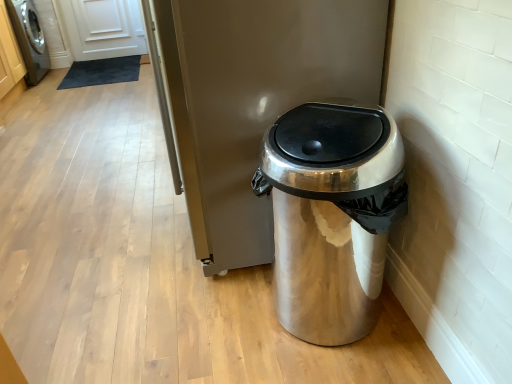
I want to click on satin silver trash can at center, so click(252, 100).

From the image's perspective, between brushed metal washing machine at left and shiny metallic trash can at lower right, which one is located above?

brushed metal washing machine at left is shown above in the image.

Is brushed metal washing machine at left situated inside shiny metallic trash can at lower right or outside?

brushed metal washing machine at left is located beyond the bounds of shiny metallic trash can at lower right.

Is brushed metal washing machine at left next to shiny metallic trash can at lower right?

No, brushed metal washing machine at left is not making contact with shiny metallic trash can at lower right.

Considering the sizes of brushed metal washing machine at left and shiny metallic trash can at lower right in the image, is brushed metal washing machine at left bigger or smaller than shiny metallic trash can at lower right?

Considering their sizes, brushed metal washing machine at left takes up more space than shiny metallic trash can at lower right.

From the picture: From a real-world perspective, is satin silver trash can at center on brushed metal washing machine at left?

Correct, in the physical world, satin silver trash can at center is higher than brushed metal washing machine at left.

From the image's perspective, which one is positioned lower, satin silver trash can at center or brushed metal washing machine at left?

From the image's view, satin silver trash can at center is below.

Is satin silver trash can at center turned away from brushed metal washing machine at left?

satin silver trash can at center is not turned away from brushed metal washing machine at left.

You are a GUI agent. You are given a task and a screenshot of the screen. Output one action in this format:
    pyautogui.click(x=<x>, y=<y>)
    Task: Click on the washing machine that is behind the satin silver trash can at center
    The width and height of the screenshot is (512, 384).
    Given the screenshot: What is the action you would take?
    pyautogui.click(x=29, y=39)

In terms of size, does brushed metal washing machine at left appear bigger or smaller than satin silver trash can at center?

Considering their sizes, brushed metal washing machine at left takes up less space than satin silver trash can at center.

Is brushed metal washing machine at left closer to the viewer compared to satin silver trash can at center?

That is False.

From a real-world perspective, between brushed metal washing machine at left and satin silver trash can at center, who is vertically higher?

In real-world perspective, satin silver trash can at center is above.

Considering the sizes of objects shiny metallic trash can at lower right and satin silver trash can at center in the image provided, who is smaller, shiny metallic trash can at lower right or satin silver trash can at center?

shiny metallic trash can at lower right.

In the image, there is a shiny metallic trash can at lower right. What are the coordinates of `appliance above it (from the image's perspective)` in the screenshot? It's located at (252, 100).

Could you tell me if shiny metallic trash can at lower right is turned towards satin silver trash can at center?

No, shiny metallic trash can at lower right is not facing towards satin silver trash can at center.

Is point (270, 57) behind point (274, 223)?

No, it is in front of (274, 223).

Find the location of a particular element. Image resolution: width=512 pixels, height=384 pixels. appliance above the shiny metallic trash can at lower right (from the image's perspective) is located at coordinates (252, 100).

In the scene shown: Is shiny metallic trash can at lower right completely or partially inside satin silver trash can at center?

No, satin silver trash can at center does not contain shiny metallic trash can at lower right.

Looking at this image, is satin silver trash can at center far from shiny metallic trash can at lower right?

satin silver trash can at center is near shiny metallic trash can at lower right, not far away.

In terms of height, does shiny metallic trash can at lower right look taller or shorter compared to brushed metal washing machine at left?

Clearly, shiny metallic trash can at lower right is shorter compared to brushed metal washing machine at left.

Is point (321, 339) positioned behind point (33, 72)?

No, (321, 339) is closer to viewer.

Is shiny metallic trash can at lower right completely or partially outside of brushed metal washing machine at left?

Yes, shiny metallic trash can at lower right is outside of brushed metal washing machine at left.

From the picture: Considering the positions of objects shiny metallic trash can at lower right and brushed metal washing machine at left in the image provided, who is in front, shiny metallic trash can at lower right or brushed metal washing machine at left?

shiny metallic trash can at lower right is closer to the camera.

Locate an element on the screen. The width and height of the screenshot is (512, 384). washing machine that appears on the left of shiny metallic trash can at lower right is located at coordinates (29, 39).

In the image, there is a satin silver trash can at center. Where is `washing machine above it (from the image's perspective)`? The height and width of the screenshot is (384, 512). washing machine above it (from the image's perspective) is located at coordinates (29, 39).

Considering their positions, is brushed metal washing machine at left positioned closer to shiny metallic trash can at lower right than satin silver trash can at center?

satin silver trash can at center lies closer to shiny metallic trash can at lower right than the other object.

Considering their positions, is satin silver trash can at center positioned further to brushed metal washing machine at left than shiny metallic trash can at lower right?

shiny metallic trash can at lower right is further to brushed metal washing machine at left.

Based on their spatial positions, is satin silver trash can at center or brushed metal washing machine at left closer to shiny metallic trash can at lower right?

The object closer to shiny metallic trash can at lower right is satin silver trash can at center.

Estimate the real-world distances between objects in this image. Which object is closer to brushed metal washing machine at left, shiny metallic trash can at lower right or satin silver trash can at center?

Among the two, satin silver trash can at center is located nearer to brushed metal washing machine at left.

Based on their spatial positions, is shiny metallic trash can at lower right or brushed metal washing machine at left further from satin silver trash can at center?

brushed metal washing machine at left is positioned further to the anchor satin silver trash can at center.

Which object lies nearer to the anchor point satin silver trash can at center, brushed metal washing machine at left or shiny metallic trash can at lower right?

shiny metallic trash can at lower right is positioned closer to the anchor satin silver trash can at center.

Where is `appliance between shiny metallic trash can at lower right and brushed metal washing machine at left along the z-axis`? The image size is (512, 384). appliance between shiny metallic trash can at lower right and brushed metal washing machine at left along the z-axis is located at coordinates (252, 100).